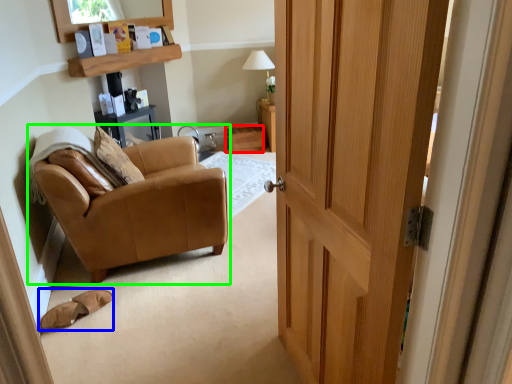
Question: Which is nearer to the drawer (highlighted by a red box)? footwear (highlighted by a blue box) or chair (highlighted by a green box).

Choices:
 (A) footwear
 (B) chair

Answer: (B)